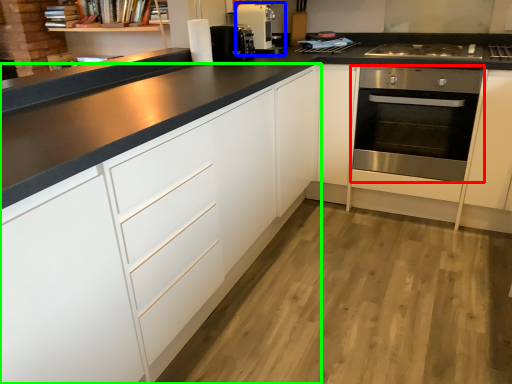
Question: Based on their relative distances, which object is nearer to oven (highlighted by a red box)? Choose from home appliance (highlighted by a blue box) and cabinetry (highlighted by a green box).

Choices:
 (A) home appliance
 (B) cabinetry

Answer: (A)